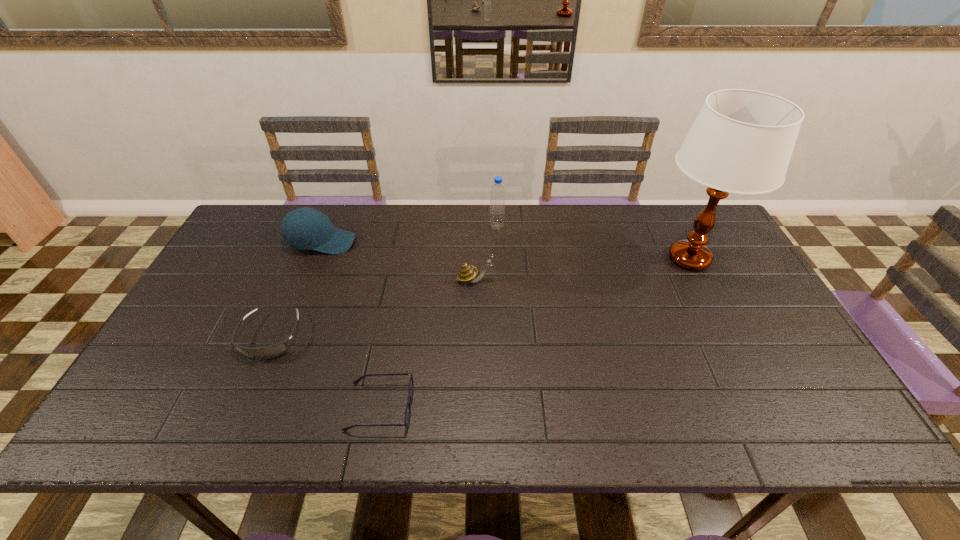
You are a GUI agent. You are given a task and a screenshot of the screen. Output one action in this format:
    pyautogui.click(x=<x>, y=<y>)
    Task: Click on the vacant space positioned 0.320m on the front-facing side of the baseball cap
    The image size is (960, 540).
    Given the screenshot: What is the action you would take?
    pyautogui.click(x=455, y=242)

At what (x,y) coordinates should I click in order to perform the action: click on blank area located 0.300m on the face of the snail. Please return your answer as a coordinate pair (x, y). The width and height of the screenshot is (960, 540). Looking at the image, I should click on (596, 280).

Identify the location of vacant space located on the lenses of the fifth farthest object. This screenshot has width=960, height=540. (231, 428).

You are a GUI agent. You are given a task and a screenshot of the screen. Output one action in this format:
    pyautogui.click(x=<x>, y=<y>)
    Task: Click on the blank area located 0.290m on the front-facing side of the nearest object
    This screenshot has height=540, width=960.
    Given the screenshot: What is the action you would take?
    [x=540, y=407]

Locate an element on the screen. This screenshot has height=540, width=960. table lamp that is positioned at the far edge is located at coordinates (741, 142).

The image size is (960, 540). I want to click on water bottle situated at the far edge, so click(497, 194).

The width and height of the screenshot is (960, 540). In order to click on baseball cap present at the far edge in this screenshot , I will do `click(305, 228)`.

Find the location of `object that is at the near edge`. object that is at the near edge is located at coordinates (407, 417).

You are a GUI agent. You are given a task and a screenshot of the screen. Output one action in this format:
    pyautogui.click(x=<x>, y=<y>)
    Task: Click on the object that is at the right edge
    
    Given the screenshot: What is the action you would take?
    (x=741, y=142)

I want to click on object situated at the far right corner, so click(741, 142).